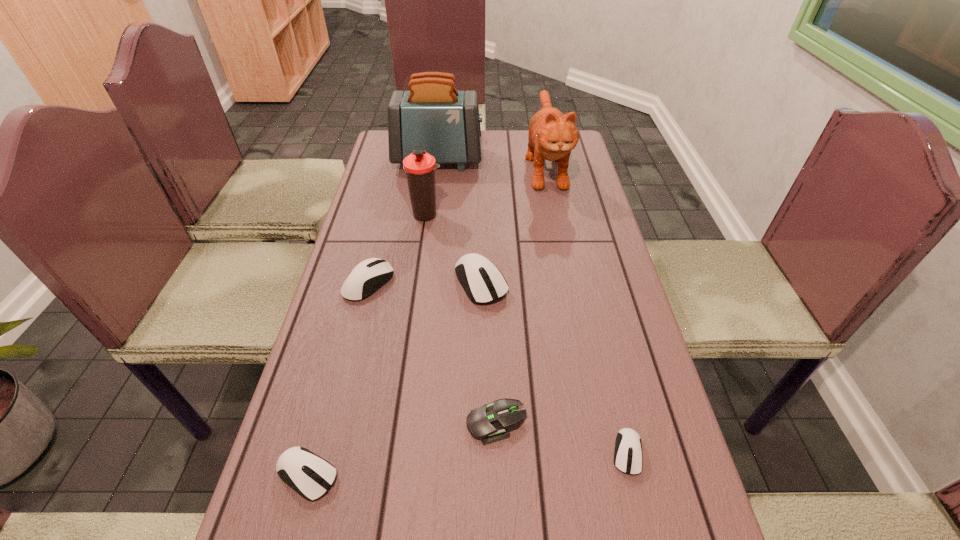
Where is `computer mouse that is the closest to the third biggest white mouse`? The height and width of the screenshot is (540, 960). computer mouse that is the closest to the third biggest white mouse is located at coordinates (489, 423).

Identify the location of computer mouse that is the nearest to the fourth shortest object. (482, 281).

Locate an element on the screen. This screenshot has height=540, width=960. the third closest white mouse relative to the fifth tallest object is located at coordinates (628, 458).

Locate which white mouse is the third closest to the toaster. Please provide its 2D coordinates. Your answer should be formatted as a tuple, i.e. [(x, y)], where the tuple contains the x and y coordinates of a point satisfying the conditions above.

[(628, 458)]

Identify the location of vacant point that satisfies the following two spatial constraints: 1. on the front-facing side of the tallest computer mouse; 2. on the right side of the toaster. (422, 282).

This screenshot has height=540, width=960. In order to click on vacant area in the image that satisfies the following two spatial constraints: 1. on the face of the ginger cat; 2. on the left side of the rightmost computer mouse in this screenshot , I will do `click(603, 453)`.

The image size is (960, 540). What are the coordinates of `vacant position in the image that satisfies the following two spatial constraints: 1. on the front side of the brown thermos bottle; 2. on the left side of the gray computer mouse` in the screenshot? It's located at (397, 423).